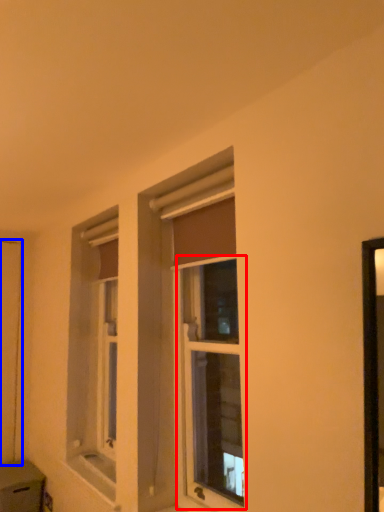
Question: Which object is closer to the camera taking this photo, window (highlighted by a red box) or screen door (highlighted by a blue box)?

Choices:
 (A) window
 (B) screen door

Answer: (A)